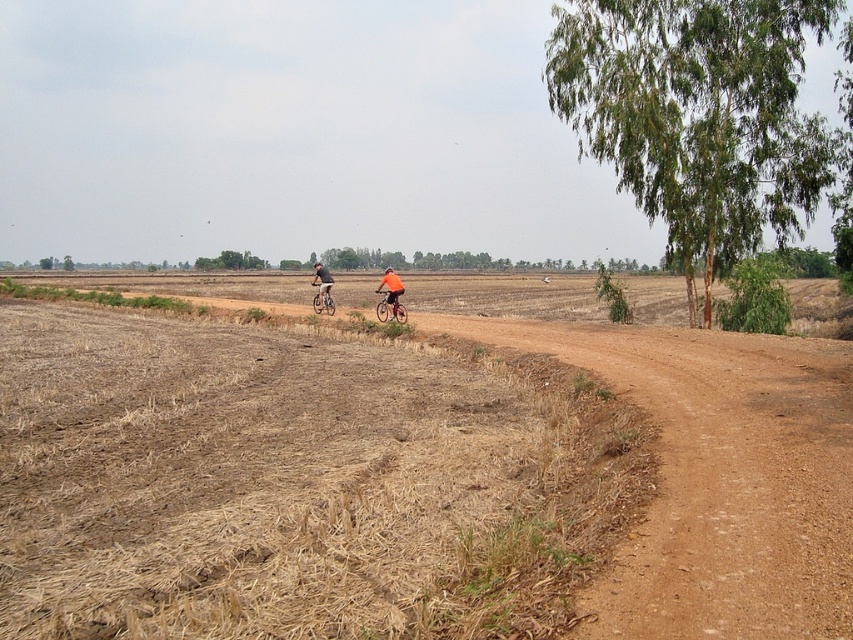
Does brown dry grass at center have a smaller size compared to green leafy tree at upper right?

Yes, brown dry grass at center is smaller than green leafy tree at upper right.

Is brown dry grass at center further to the viewer compared to green leafy tree at upper right?

No, brown dry grass at center is closer to the viewer.

This screenshot has width=853, height=640. Identify the location of brown dry grass at center. (293, 481).

Does orange fabric cyclist at center come behind orange matte bicycle at center?

Yes, orange fabric cyclist at center is further from the viewer.

Can you confirm if orange fabric cyclist at center is smaller than orange matte bicycle at center?

No, orange fabric cyclist at center is not smaller than orange matte bicycle at center.

This screenshot has height=640, width=853. What do you see at coordinates (322, 289) in the screenshot?
I see `orange fabric cyclist at center` at bounding box center [322, 289].

Locate an element on the screen. orange fabric cyclist at center is located at coordinates (322, 289).

Is brown dry grass at center wider than orange fabric cyclist at center?

Correct, the width of brown dry grass at center exceeds that of orange fabric cyclist at center.

Measure the distance between point (271, 401) and camera.

They are 46.09 feet apart.

Does point (265, 424) lie in front of point (322, 285)?

Yes, it is in front of point (322, 285).

Where is `brown dry grass at center`? This screenshot has width=853, height=640. brown dry grass at center is located at coordinates (293, 481).